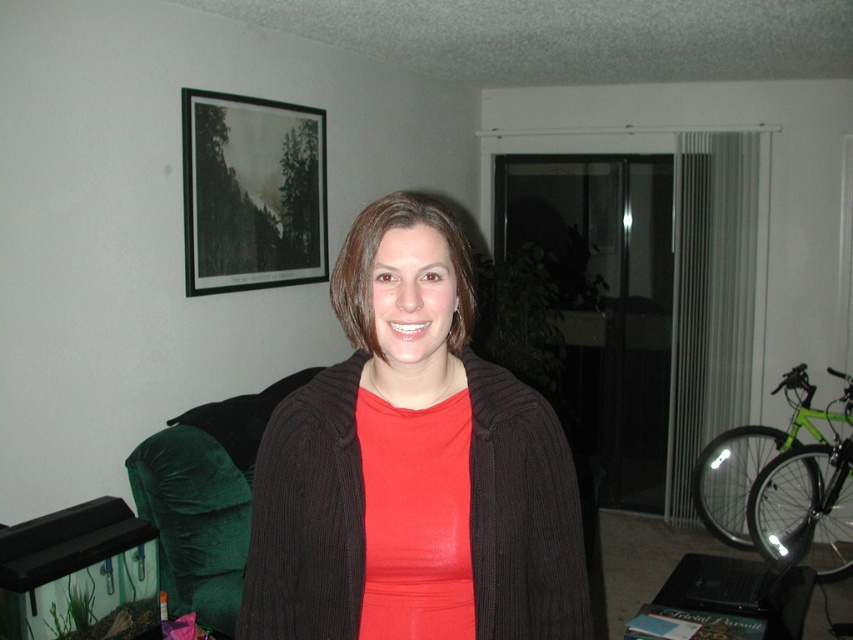
You are planning to hang a new large painting that is wider than the black matte picture frame at upper left. If you want to place it near the velvet green armchair at left, will it fit horizontally without overlapping the armchair?

The black matte picture frame at upper left has a lesser width compared to the velvet green armchair at left. Since the new painting is wider than the frame, it may not fit without overlapping the velvet green armchair at left if the available space is limited. Check the exact dimensions to confirm.

You are a photographer trying to capture a closeup shot of the matte black sweater at center. Your camera has a minimum focusing distance of 40 inches. Will you be able to take the photo without moving closer than necessary?

The matte black sweater at center is 38.62 inches away from the camera. Since the minimum focusing distance is 40 inches, you need to move back approximately 1.38 inches to ensure proper focus.